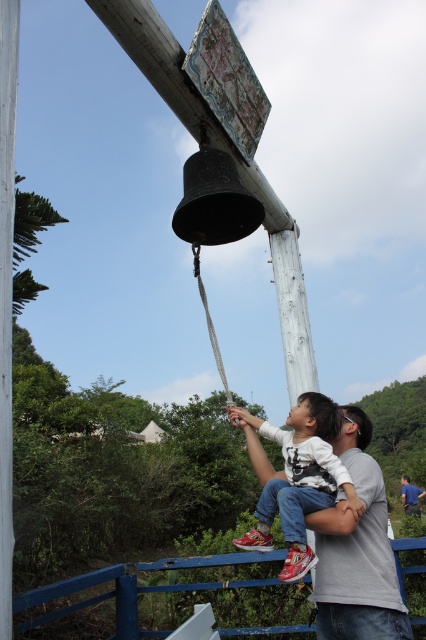
Question: Which object is the farthest from the white cotton shirt at center?

Choices:
 (A) gray fabric shirt at upper center
 (B) gray cotton shirt at center

Answer: (A)

Question: Is gray cotton shirt at center wider than gray fabric shirt at upper center?

Choices:
 (A) no
 (B) yes

Answer: (B)

Question: Is gray cotton shirt at center thinner than gray fabric shirt at upper center?

Choices:
 (A) no
 (B) yes

Answer: (A)

Question: Which object is farther from the camera taking this photo?

Choices:
 (A) white cotton shirt at center
 (B) gray fabric shirt at upper center

Answer: (B)

Question: Which of the following is the closest to the observer?

Choices:
 (A) white cotton shirt at center
 (B) gray cotton shirt at center

Answer: (A)

Question: Can you confirm if gray cotton shirt at center is positioned above gray fabric shirt at upper center?

Choices:
 (A) no
 (B) yes

Answer: (B)